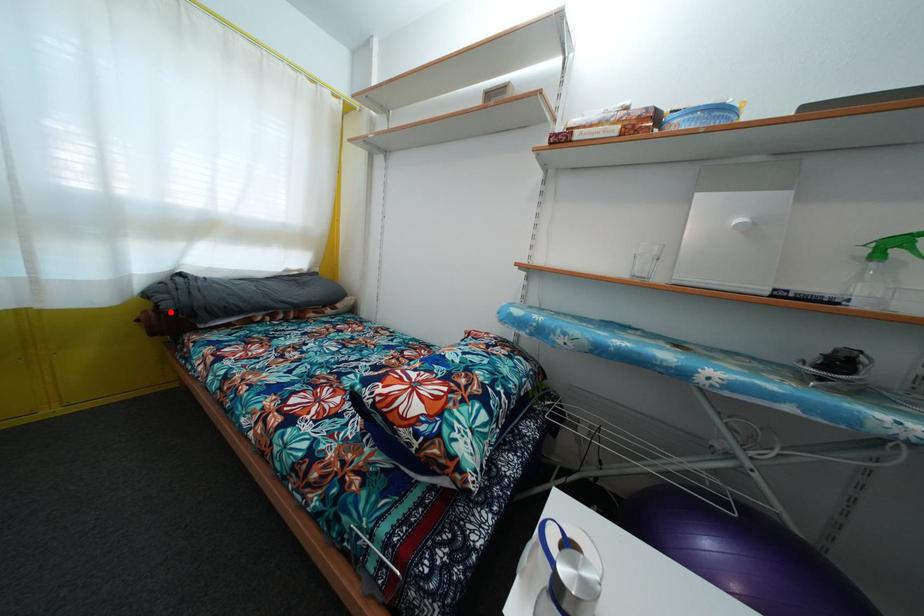
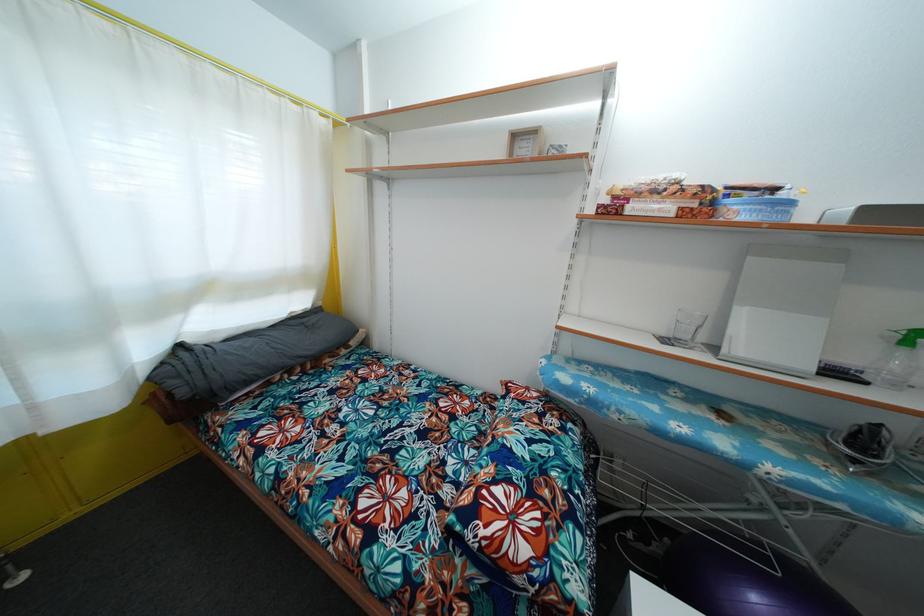
Where in the second image is the point corresponding to the highlighted location from the first image?

(187, 399)